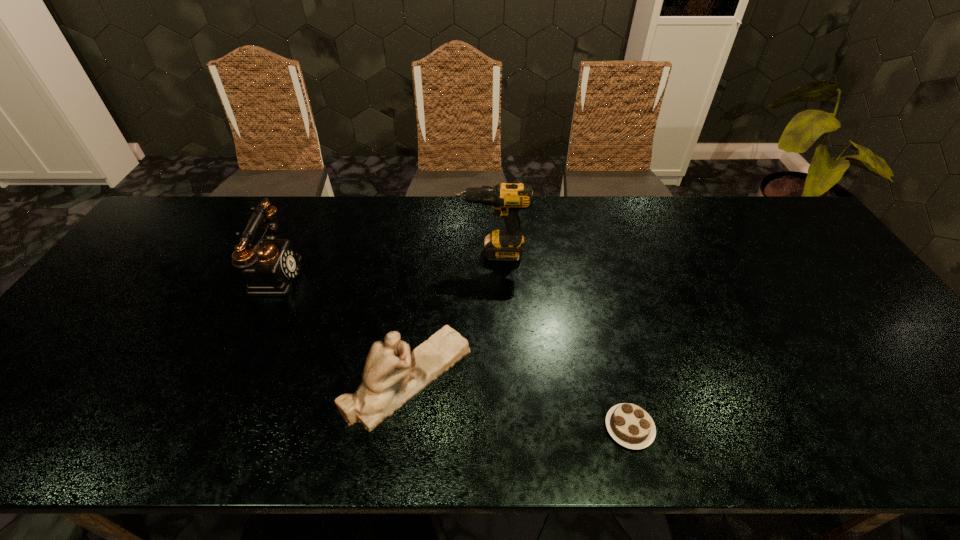
Where is `the tallest object`? The height and width of the screenshot is (540, 960). the tallest object is located at coordinates (507, 199).

Where is `the second tallest object`? the second tallest object is located at coordinates 270,268.

This screenshot has height=540, width=960. I want to click on telephone, so click(x=270, y=268).

Identify the location of figurine. (392, 376).

Where is `chocolate cake`? Image resolution: width=960 pixels, height=540 pixels. chocolate cake is located at coordinates (629, 425).

Locate an element on the screen. This screenshot has height=540, width=960. the rightmost object is located at coordinates (629, 425).

The image size is (960, 540). I want to click on free space located at the tip of the drill, so click(x=390, y=253).

The width and height of the screenshot is (960, 540). What are the coordinates of `free space located 0.350m at the tip of the drill` in the screenshot? It's located at pos(344,253).

The height and width of the screenshot is (540, 960). I want to click on vacant space situated 0.300m at the tip of the drill, so click(x=360, y=253).

Image resolution: width=960 pixels, height=540 pixels. I want to click on vacant space located 0.090m on the front of the telephone at the rotary dial, so click(x=331, y=274).